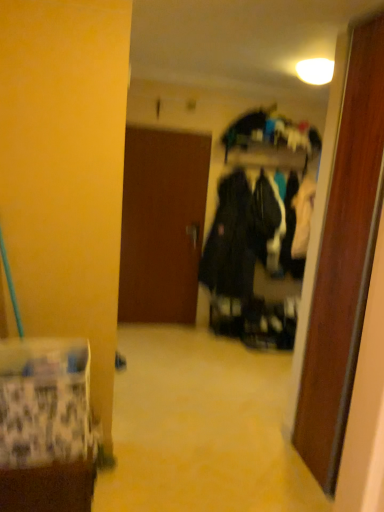
Question: Considering the positions of point (150, 214) and point (74, 446), is point (150, 214) closer or farther from the camera than point (74, 446)?

Choices:
 (A) farther
 (B) closer

Answer: (A)

Question: Looking at the image, does brown matte door at center seem bigger or smaller compared to patterned fabric bag at lower left?

Choices:
 (A) small
 (B) big

Answer: (B)

Question: From a real-world perspective, is brown matte door at center physically located above or below patterned fabric bag at lower left?

Choices:
 (A) above
 (B) below

Answer: (A)

Question: From the image's perspective, is patterned fabric bag at lower left above or below brown matte door at center?

Choices:
 (A) below
 (B) above

Answer: (A)

Question: Considering the relative positions of patterned fabric bag at lower left and brown matte door at center in the image provided, is patterned fabric bag at lower left to the left or to the right of brown matte door at center?

Choices:
 (A) left
 (B) right

Answer: (A)

Question: Is patterned fabric bag at lower left inside or outside of brown matte door at center?

Choices:
 (A) inside
 (B) outside

Answer: (B)

Question: In terms of width, does patterned fabric bag at lower left look wider or thinner when compared to brown matte door at center?

Choices:
 (A) wide
 (B) thin

Answer: (A)